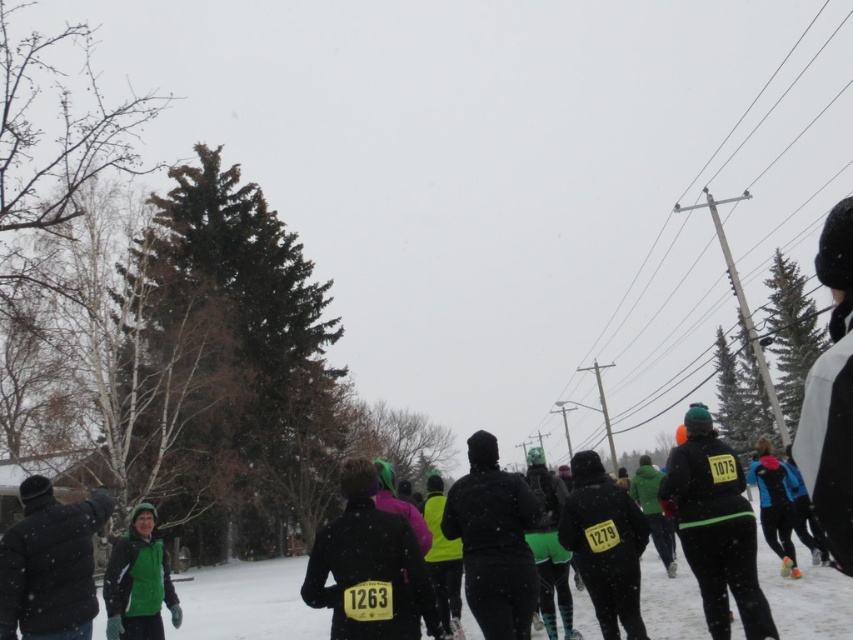
Does point (339, 570) lie behind point (120, 628)?

No, it is not.

In the scene shown: Is black matte jacket at center behind green fleece jacket at lower left?

No, black matte jacket at center is in front of green fleece jacket at lower left.

Between point (401, 525) and point (148, 595), which one is positioned behind?

The point (148, 595) is more distant.

The image size is (853, 640). Identify the location of black matte jacket at center. (370, 564).

Measure the distance between black matte jacket at center and dark green jacket at lower left.

black matte jacket at center is 8.26 feet away from dark green jacket at lower left.

How distant is black matte jacket at center from dark green jacket at lower left?

2.52 meters

Who is more forward, (372, 531) or (35, 529)?

Point (372, 531) is in front.

You are a GUI agent. You are given a task and a screenshot of the screen. Output one action in this format:
    pyautogui.click(x=<x>, y=<y>)
    Task: Click on the black matte jacket at center
    The image size is (853, 640).
    Given the screenshot: What is the action you would take?
    pyautogui.click(x=370, y=564)

Is dark green jacket at lower left further to the viewer compared to green fleece jacket at lower left?

No, dark green jacket at lower left is closer to the viewer.

Which is in front, point (19, 602) or point (144, 568)?

Positioned in front is point (19, 602).

Is point (50, 515) positioned after point (107, 605)?

No.

At what (x,y) coordinates should I click in order to perform the action: click on dark green jacket at lower left. Please return your answer as a coordinate pair (x, y). The height and width of the screenshot is (640, 853). Looking at the image, I should click on (50, 564).